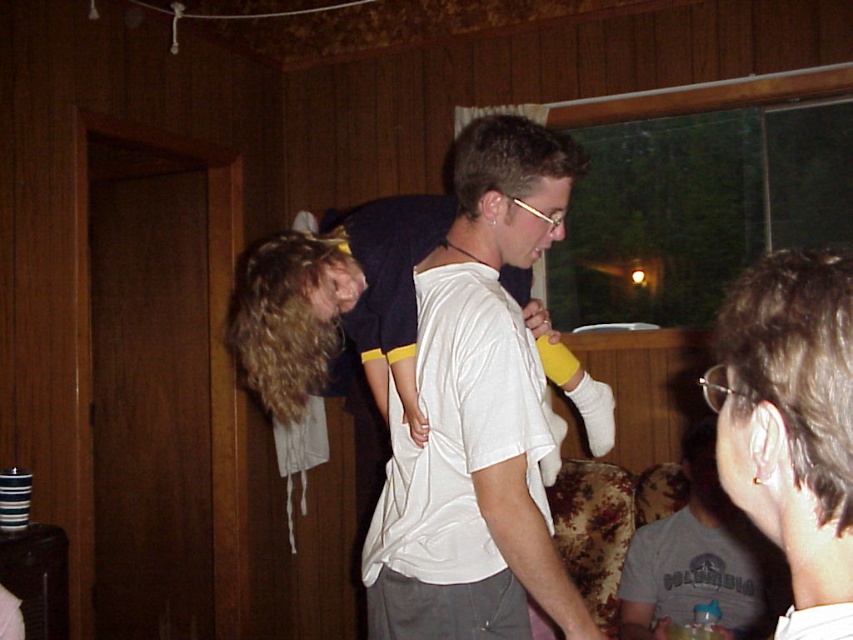
Based on the photo, does blonde hair at center come in front of gray cotton t-shirt at center?

Yes, it is in front of gray cotton t-shirt at center.

This screenshot has height=640, width=853. Find the location of `blonde hair at center`. blonde hair at center is located at coordinates (477, 413).

At what (x,y) coordinates should I click in order to perform the action: click on blonde hair at center. Please return your answer as a coordinate pair (x, y). The width and height of the screenshot is (853, 640). Looking at the image, I should click on (477, 413).